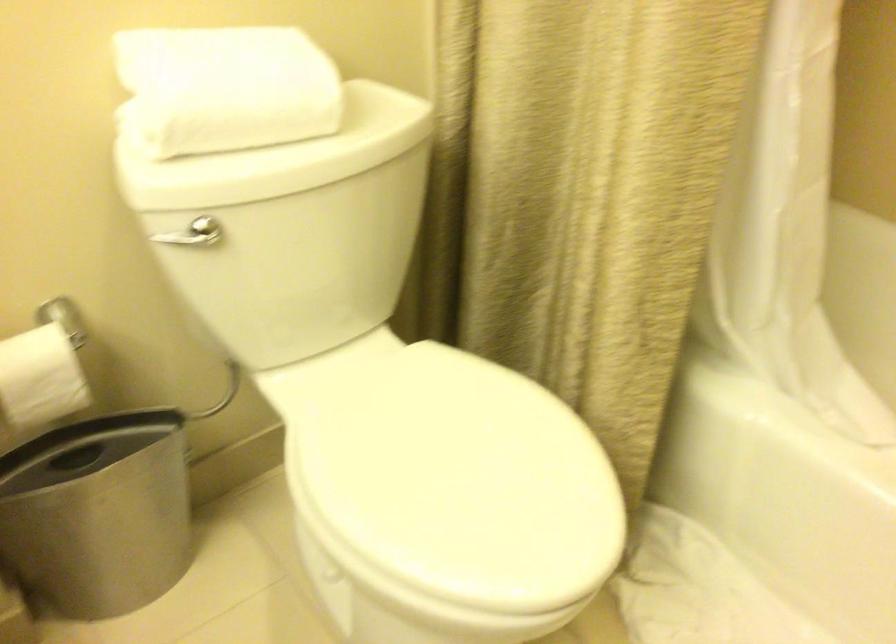
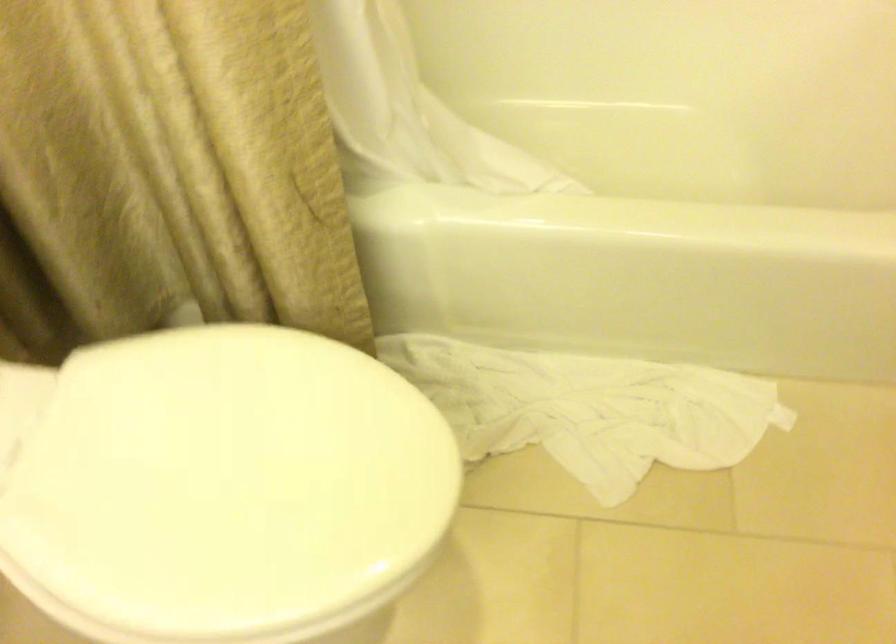
Locate, in the second image, the point that corresponds to point (441, 471) in the first image.

(219, 484)